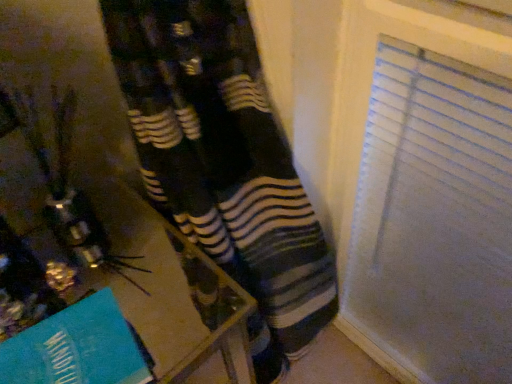
At what (x,y) coordinates should I click in order to perform the action: click on free spot above teal paper at lower left (from a real-world perspective). Please return your answer as a coordinate pair (x, y). The height and width of the screenshot is (384, 512). Looking at the image, I should click on (64, 346).